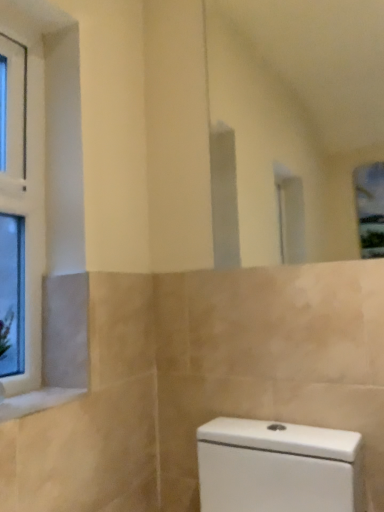
Where is `white marble window sill at lower left`? Image resolution: width=384 pixels, height=512 pixels. white marble window sill at lower left is located at coordinates (36, 401).

Image resolution: width=384 pixels, height=512 pixels. Describe the element at coordinates (36, 401) in the screenshot. I see `white marble window sill at lower left` at that location.

What is the approximate height of white marble window sill at lower left?

It is 2.51 centimeters.

What are the coordinates of `white glass window at left` in the screenshot? It's located at (21, 216).

What do you see at coordinates (21, 216) in the screenshot?
I see `white glass window at left` at bounding box center [21, 216].

Image resolution: width=384 pixels, height=512 pixels. Identify the location of white marble window sill at lower left. (36, 401).

Is white glass window at left at the right side of white marble window sill at lower left?

No.

Is white glass window at left further to the viewer compared to white marble window sill at lower left?

Yes, the depth of white glass window at left is greater than that of white marble window sill at lower left.

Does point (7, 303) lie in front of point (79, 392)?

No.

From the image's perspective, which one is positioned higher, white glass window at left or white marble window sill at lower left?

white glass window at left.

From a real-world perspective, which object stands above the other?

white glass window at left.

Does white glass window at left have a lesser width compared to white marble window sill at lower left?

Indeed, white glass window at left has a lesser width compared to white marble window sill at lower left.

Considering the relative sizes of white glass window at left and white marble window sill at lower left in the image provided, is white glass window at left shorter than white marble window sill at lower left?

Incorrect, the height of white glass window at left does not fall short of that of white marble window sill at lower left.

Who is bigger, white glass window at left or white marble window sill at lower left?

white glass window at left.

Is white glass window at left located outside white marble window sill at lower left?

Yes.

Is white glass window at left directly adjacent to white marble window sill at lower left?

No, white glass window at left is not beside white marble window sill at lower left.

Does white glass window at left turn towards white marble window sill at lower left?

No.

How much distance is there between white glass window at left and white marble window sill at lower left?

14.83 inches.

Identify the location of window sill in front of the white glass window at left. (36, 401).

Based on their positions, is white marble window sill at lower left located to the left or right of white glass window at left?

Clearly, white marble window sill at lower left is on the right of white glass window at left in the image.

From the picture: Relative to white glass window at left, is white marble window sill at lower left in front or behind?

white marble window sill at lower left is positioned closer to the viewer than white glass window at left.

Considering the positions of points (24, 400) and (38, 156), is point (24, 400) closer to camera compared to point (38, 156)?

Yes, it is in front of point (38, 156).

From the image's perspective, relative to white glass window at left, is white marble window sill at lower left above or below?

From the image's perspective, white marble window sill at lower left appears below white glass window at left.

From a real-world perspective, between white marble window sill at lower left and white glass window at left, who is vertically higher?

white glass window at left is physically above.

Which of these two, white marble window sill at lower left or white glass window at left, is wider?

Wider between the two is white marble window sill at lower left.

Is white marble window sill at lower left shorter than white glass window at left?

Correct, white marble window sill at lower left is not as tall as white glass window at left.

Which of these two, white marble window sill at lower left or white glass window at left, is bigger?

Bigger between the two is white glass window at left.

Is white glass window at left surrounded by white marble window sill at lower left?

No, white glass window at left is not surrounded by white marble window sill at lower left.

Is white marble window sill at lower left touching white glass window at left?

No.

Consider the image. Is white marble window sill at lower left oriented towards white glass window at left?

No, white marble window sill at lower left does not turn towards white glass window at left.

How different are the orientations of white marble window sill at lower left and white glass window at left in degrees?

The facing directions of white marble window sill at lower left and white glass window at left are 0.000111 degrees apart.

This screenshot has width=384, height=512. What are the coordinates of `window lying behind the white marble window sill at lower left` in the screenshot? It's located at (21, 216).

Identify the location of window lying on the left of white marble window sill at lower left. This screenshot has width=384, height=512. (21, 216).

What are the coordinates of `window sill on the right of white glass window at left` in the screenshot? It's located at (36, 401).